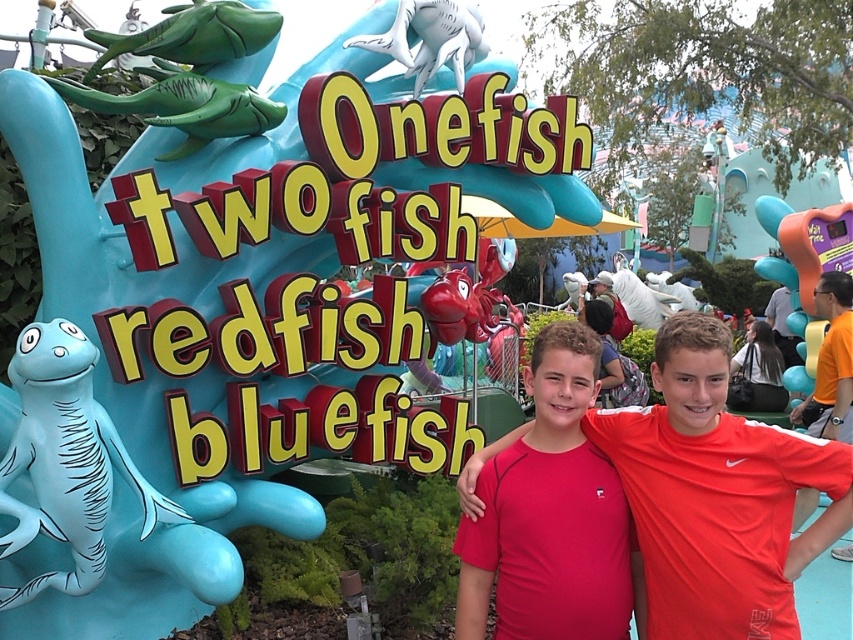
Question: Which of the following is the farthest from the observer?

Choices:
 (A) pink fabric shirt at center
 (B) red matte shirt at center

Answer: (A)

Question: Which point is closer to the camera?

Choices:
 (A) pink fabric shirt at center
 (B) red matte shirt at center

Answer: (B)

Question: Can you confirm if red matte shirt at center is positioned to the left of pink fabric shirt at center?

Choices:
 (A) yes
 (B) no

Answer: (B)

Question: Which point appears farthest from the camera in this image?

Choices:
 (A) (590, 525)
 (B) (756, 540)

Answer: (A)

Question: Is red matte shirt at center closer to camera compared to pink fabric shirt at center?

Choices:
 (A) no
 (B) yes

Answer: (B)

Question: Does red matte shirt at center have a larger size compared to pink fabric shirt at center?

Choices:
 (A) no
 (B) yes

Answer: (B)